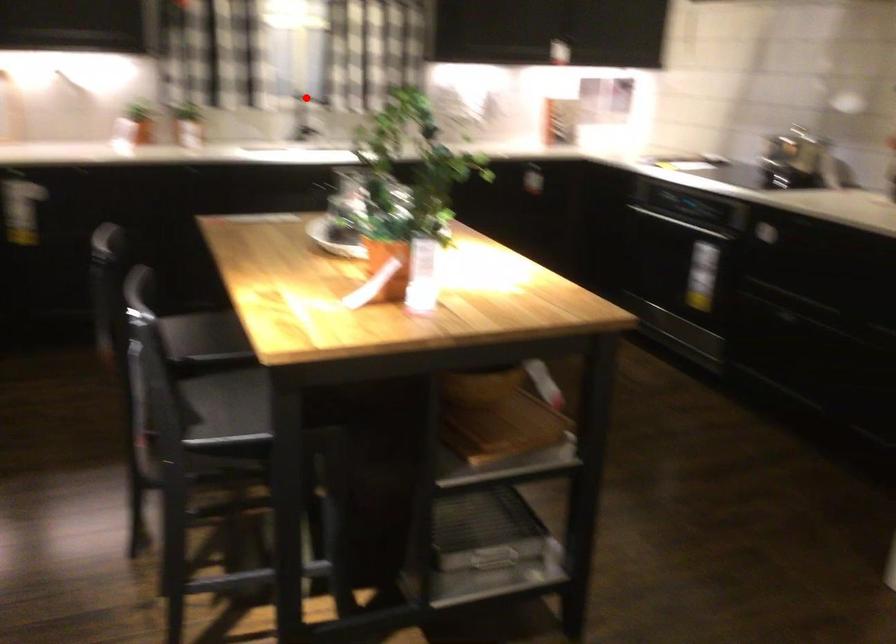
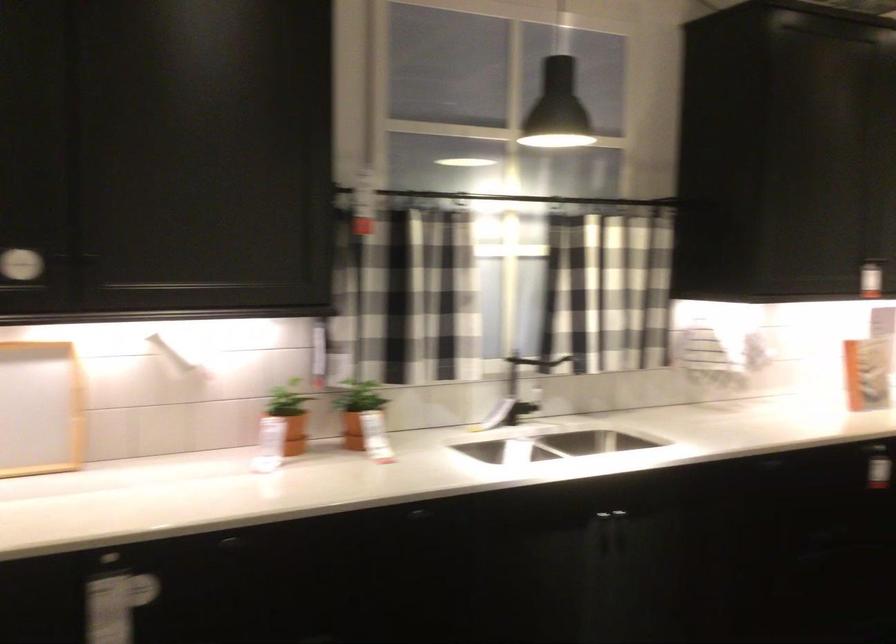
Locate, in the second image, the point that corresponds to the highlighted location in the first image.

(520, 370)